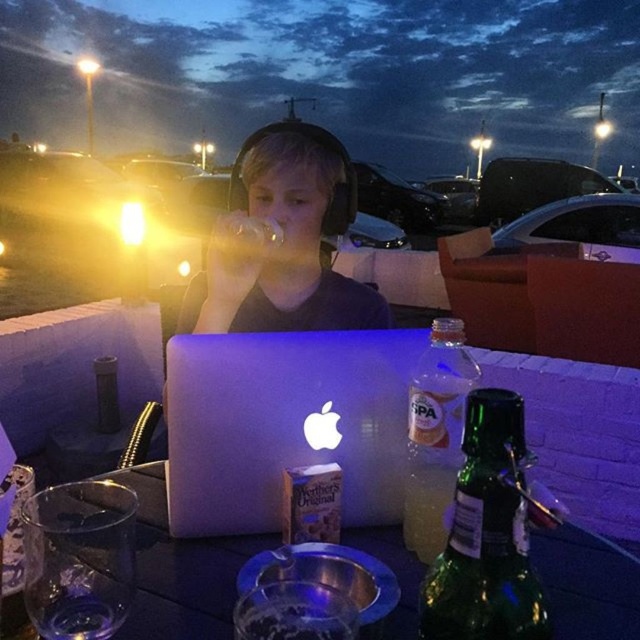
Question: Which point appears closest to the camera in this image?

Choices:
 (A) (417, 636)
 (B) (372, 552)
 (C) (433, 509)

Answer: (A)

Question: Can you confirm if white plastic laptop at center is smaller than clear plastic bottle at right?

Choices:
 (A) yes
 (B) no

Answer: (B)

Question: Which point is closer to the camera taking this photo?

Choices:
 (A) (180, 589)
 (B) (452, 337)
 (C) (454, 566)
 (D) (252, 513)

Answer: (C)

Question: Which object appears closest to the camera in this image?

Choices:
 (A) green glass bottle at lower right
 (B) shiny black table at center

Answer: (A)

Question: Can you confirm if shiny black table at center is thinner than green glass bottle at lower right?

Choices:
 (A) no
 (B) yes

Answer: (A)

Question: From the image, what is the correct spatial relationship of shiny black table at center in relation to green glass bottle at lower right?

Choices:
 (A) above
 (B) below

Answer: (B)